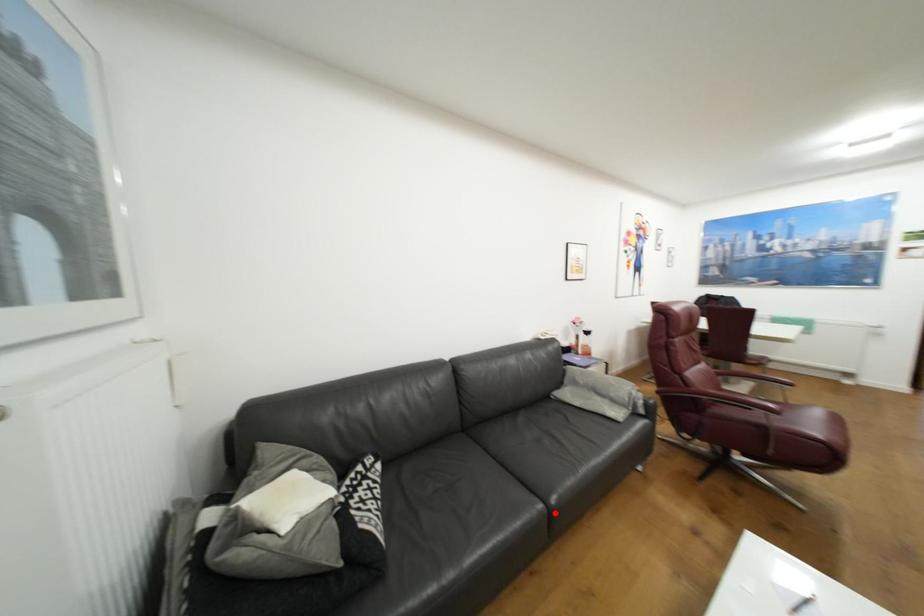
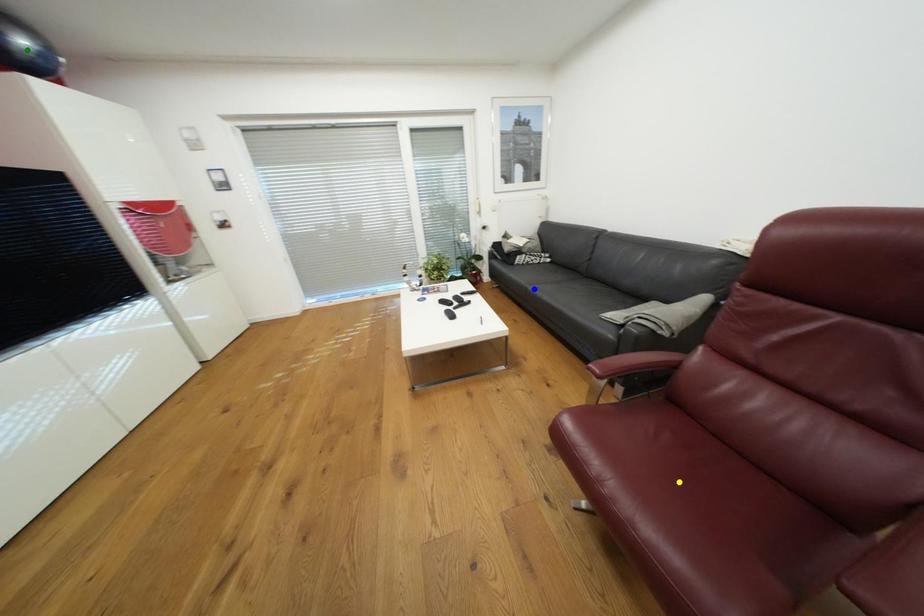
Question: I am providing you with two images of the same scene from different viewpoints. A red point is marked on the first image. You are given multiple points on the second image. Can you choose the point in image 2 that corresponds to the point in image 1?

Choices:
 (A) yellow point
 (B) green point
 (C) blue point

Answer: (C)